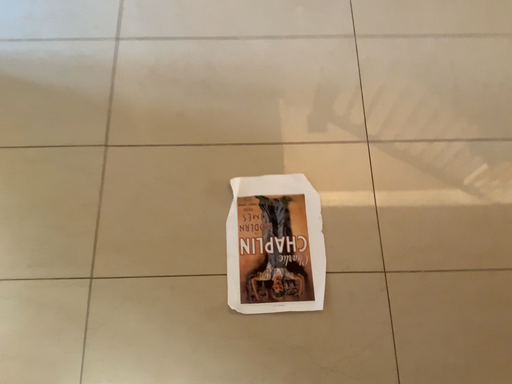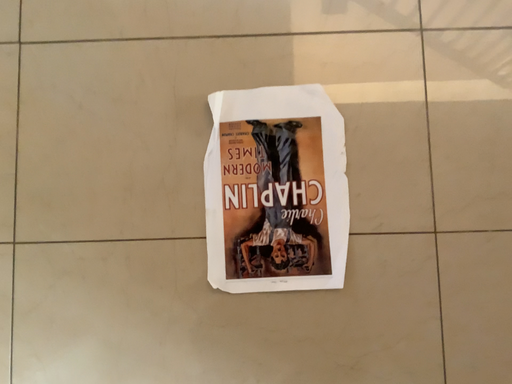
Question: How did the camera likely rotate when shooting the video?

Choices:
 (A) rotated upward
 (B) rotated downward

Answer: (B)